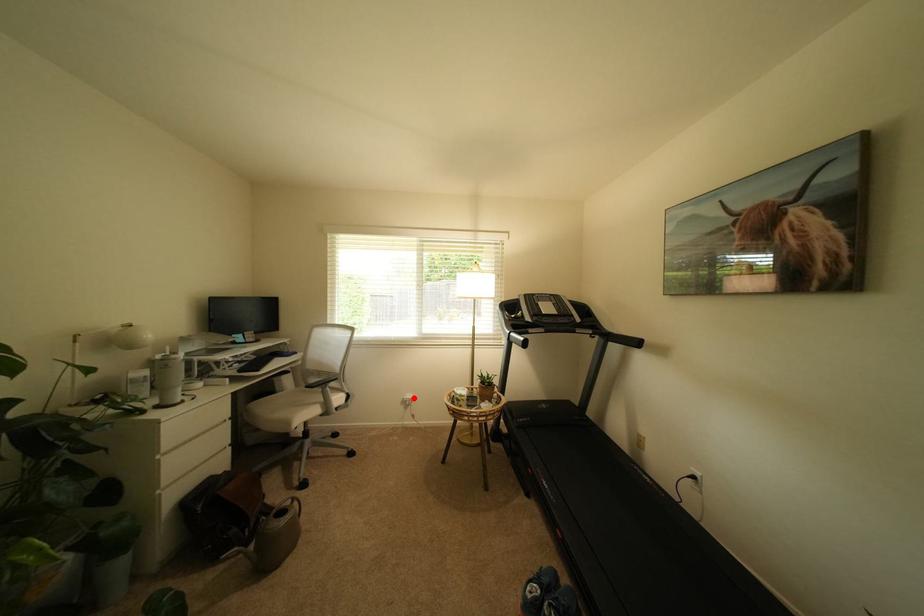
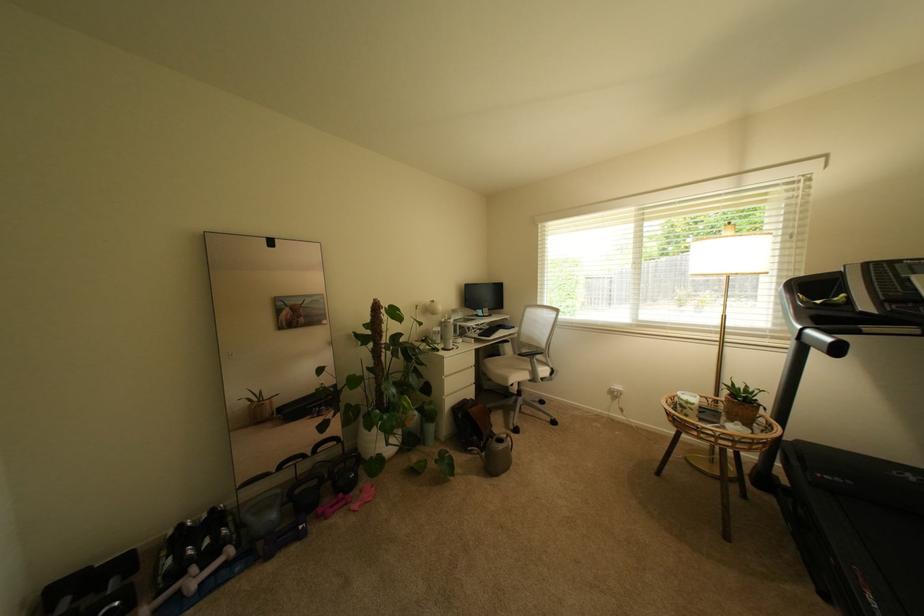
Locate, in the second image, the point that corresponds to the highlighted location in the first image.

(622, 389)